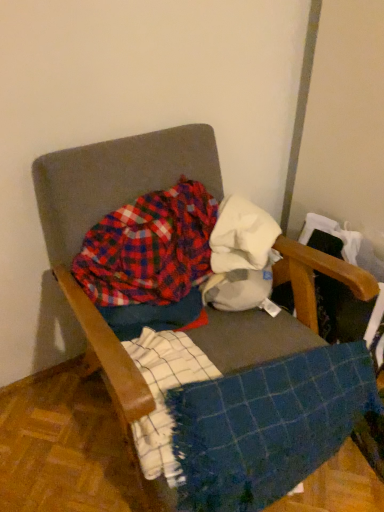
In order to face white cotton cloth at center, should I rotate leftwards or rightwards?

To face it directly, rotate right by 7.456 degrees.

What do you see at coordinates (267, 426) in the screenshot? The image size is (384, 512). I see `blue woven blanket at center` at bounding box center [267, 426].

The image size is (384, 512). Describe the element at coordinates (149, 248) in the screenshot. I see `plaid cotton shirt at center` at that location.

You are a GUI agent. You are given a task and a screenshot of the screen. Output one action in this format:
    pyautogui.click(x=<x>, y=<y>)
    Task: Click on the white cotton cloth at center
    The height and width of the screenshot is (512, 384).
    Given the screenshot: What is the action you would take?
    pyautogui.click(x=241, y=236)

From a real-world perspective, is white cotton cloth at center physically located above or below textured fabric chair at center?

From a real-world perspective, white cotton cloth at center is physically above textured fabric chair at center.

From the image's perspective, is white cotton cloth at center positioned above or below textured fabric chair at center?

Based on their image positions, white cotton cloth at center is located above textured fabric chair at center.

Who is more distant, white cotton cloth at center or textured fabric chair at center?

white cotton cloth at center is behind.

Is white cotton cloth at center far from textured fabric chair at center?

No, white cotton cloth at center is not far away from textured fabric chair at center.

Is textured fabric chair at center surrounded by plaid cotton shirt at center?

No, textured fabric chair at center is not a part of plaid cotton shirt at center.

Considering the positions of objects plaid cotton shirt at center and textured fabric chair at center in the image provided, who is more to the right, plaid cotton shirt at center or textured fabric chair at center?

textured fabric chair at center is more to the right.

Does plaid cotton shirt at center have a greater height compared to textured fabric chair at center?

Incorrect, the height of plaid cotton shirt at center is not larger of that of textured fabric chair at center.

From a real-world perspective, is plaid cotton shirt at center physically below textured fabric chair at center?

Incorrect, from a real-world perspective, plaid cotton shirt at center is higher than textured fabric chair at center.

Considering the points (357, 421) and (170, 260), which point is in front, point (357, 421) or point (170, 260)?

The point (170, 260) is more forward.

Which of these two, blue woven blanket at center or plaid cotton shirt at center, stands shorter?

plaid cotton shirt at center.

From the image's perspective, which one is positioned lower, blue woven blanket at center or plaid cotton shirt at center?

blue woven blanket at center, from the image's perspective.

Find the location of `chair located below the plaid cotton shirt at center (from the image's perspective)`. chair located below the plaid cotton shirt at center (from the image's perspective) is located at coordinates (101, 216).

Considering the positions of objects textured fabric chair at center and plaid cotton shirt at center in the image provided, who is more to the left, textured fabric chair at center or plaid cotton shirt at center?

Positioned to the left is plaid cotton shirt at center.

Considering the relative sizes of textured fabric chair at center and plaid cotton shirt at center in the image provided, is textured fabric chair at center shorter than plaid cotton shirt at center?

No, textured fabric chair at center is not shorter than plaid cotton shirt at center.

In the scene shown: Is blue woven blanket at center positioned with its back to textured fabric chair at center?

Absolutely, blue woven blanket at center is directed away from textured fabric chair at center.

Is the position of blue woven blanket at center more distant than that of textured fabric chair at center?

Yes, the depth of blue woven blanket at center is greater than that of textured fabric chair at center.

Which of these two, blue woven blanket at center or textured fabric chair at center, stands shorter?

Standing shorter between the two is blue woven blanket at center.

Identify the location of chair on the left of the blue woven blanket at center. This screenshot has width=384, height=512. (101, 216).

Is textured fabric chair at center placed right next to white cotton cloth at center?

textured fabric chair at center and white cotton cloth at center are not in contact.

Could you tell me if textured fabric chair at center is turned towards white cotton cloth at center?

No, textured fabric chair at center is not aimed at white cotton cloth at center.

I want to click on fabric behind the textured fabric chair at center, so click(x=241, y=236).

How many degrees apart are the facing directions of textured fabric chair at center and white cotton cloth at center?

textured fabric chair at center and white cotton cloth at center are facing 48.2 degrees away from each other.

Can we say blue woven blanket at center lies outside white cotton cloth at center?

That's correct, blue woven blanket at center is outside of white cotton cloth at center.

Would you say blue woven blanket at center is to the left or to the right of white cotton cloth at center in the picture?

Based on their positions, blue woven blanket at center is located to the right of white cotton cloth at center.

Between blue woven blanket at center and white cotton cloth at center, which one is positioned in front?

blue woven blanket at center is more forward.

From the image's perspective, relative to white cotton cloth at center, is blue woven blanket at center above or below?

Clearly, from the image's perspective, blue woven blanket at center is below white cotton cloth at center.

The image size is (384, 512). Identify the location of chair in front of the white cotton cloth at center. (101, 216).

You are a GUI agent. You are given a task and a screenshot of the screen. Output one action in this format:
    pyautogui.click(x=<x>, y=<y>)
    Task: Click on the flannel on the left of textured fabric chair at center
    
    Given the screenshot: What is the action you would take?
    pyautogui.click(x=149, y=248)

Based on their spatial positions, is textured fabric chair at center or white cotton cloth at center further from plaid cotton shirt at center?

Based on the image, white cotton cloth at center appears to be further to plaid cotton shirt at center.

From the image, which object appears to be nearer to plaid cotton shirt at center, blue woven blanket at center or textured fabric chair at center?

The object closer to plaid cotton shirt at center is textured fabric chair at center.

From the image, which object appears to be nearer to plaid cotton shirt at center, blue woven blanket at center or white cotton cloth at center?

The object closer to plaid cotton shirt at center is white cotton cloth at center.

When comparing their distances from white cotton cloth at center, does textured fabric chair at center or blue woven blanket at center seem further?

blue woven blanket at center.

From the image, which object appears to be farther from blue woven blanket at center, white cotton cloth at center or plaid cotton shirt at center?

Among the two, plaid cotton shirt at center is located further to blue woven blanket at center.

Looking at the image, which one is located closer to blue woven blanket at center, plaid cotton shirt at center or white cotton cloth at center?

white cotton cloth at center.

Estimate the real-world distances between objects in this image. Which object is closer to white cotton cloth at center, textured fabric chair at center or plaid cotton shirt at center?

plaid cotton shirt at center lies closer to white cotton cloth at center than the other object.

Estimate the real-world distances between objects in this image. Which object is further from white cotton cloth at center, plaid cotton shirt at center or blue woven blanket at center?

The object further to white cotton cloth at center is blue woven blanket at center.

The width and height of the screenshot is (384, 512). Find the location of `chair between plaid cotton shirt at center and blue woven blanket at center in the vertical direction`. chair between plaid cotton shirt at center and blue woven blanket at center in the vertical direction is located at coordinates (101, 216).

This screenshot has width=384, height=512. In order to click on flannel between white cotton cloth at center and blue woven blanket at center vertically in this screenshot , I will do `click(149, 248)`.

Image resolution: width=384 pixels, height=512 pixels. I want to click on flannel located between textured fabric chair at center and white cotton cloth at center in the depth direction, so click(149, 248).

Identify the location of chair between white cotton cloth at center and blue woven blanket at center vertically. The width and height of the screenshot is (384, 512). (101, 216).